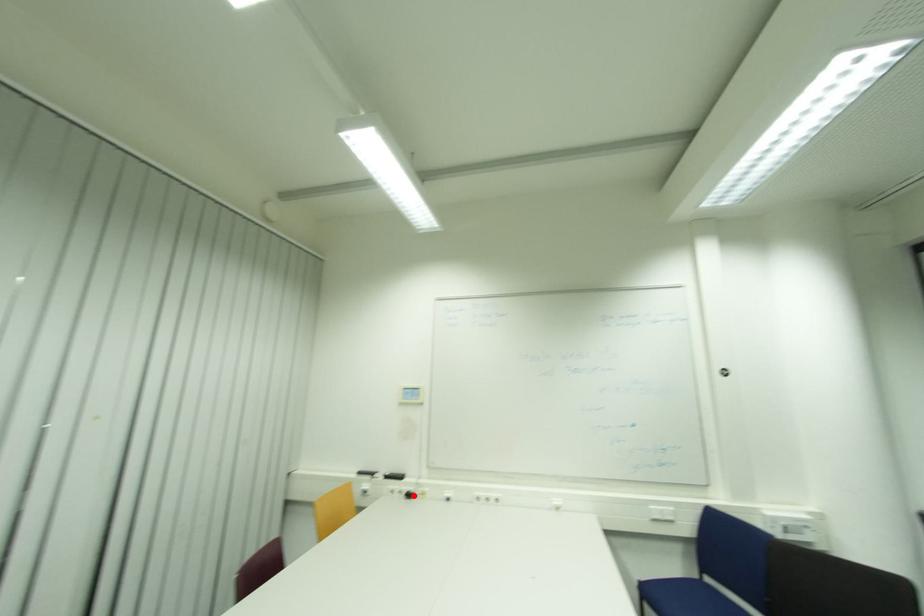
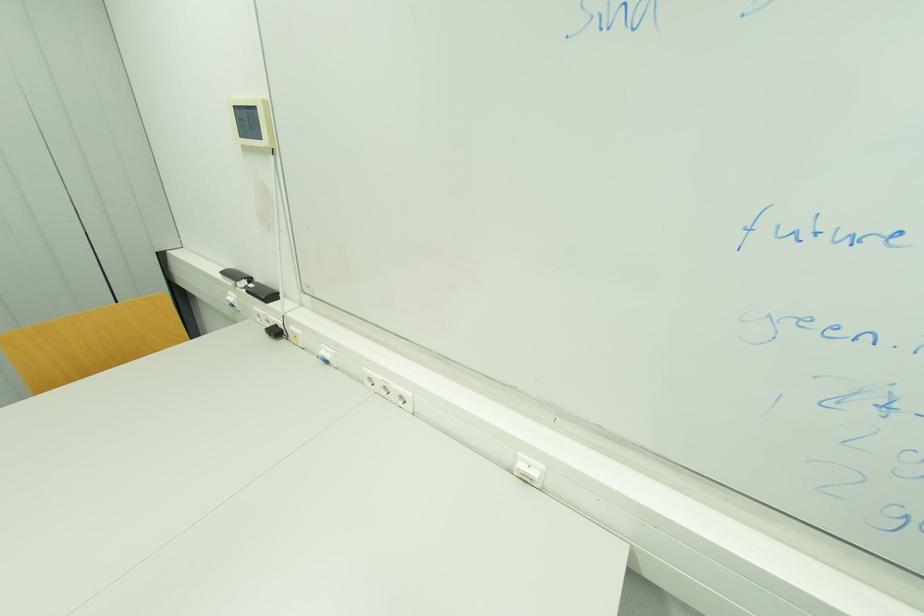
Question: I am providing you with two images of the same scene from different viewpoints. A red point is marked on the first image. At the location where the point appears in image 1, is it still visible in image 2?

Choices:
 (A) Yes
 (B) No

Answer: (A)